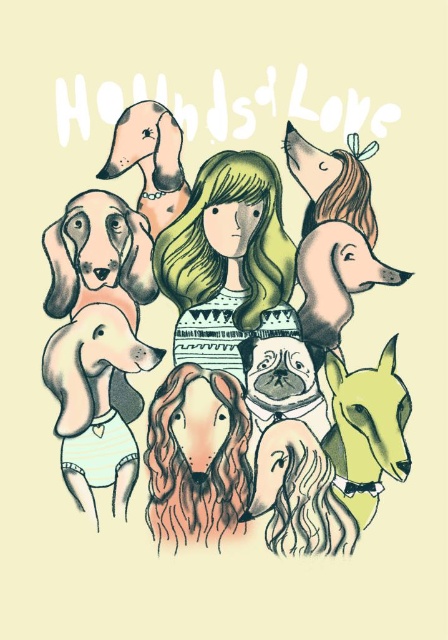
You are an artist who wants to paint a scene similar to the one described. You have a canvas that is 10 centimeters wide. If you want to place both the pastel watercolor dogs at center and the matte green dress at center on the canvas, will they fit side by side horizontally?

The pastel watercolor dogs at center and matte green dress at center are 6.21 centimeters apart from each other. Since the canvas is 10 centimeters wide, there is enough space to fit both elements side by side horizontally as 6.21 cm is less than 10 cm.

You are an art student analyzing the composition of this image. You notice the pastel watercolor dogs at center and the smooth beige dog at upper left. Which of these two elements appears closer to the viewer in the artwork?

The pastel watercolor dogs at center appear closer to the viewer than the smooth beige dog at upper left because they are positioned in front of it in the composition.